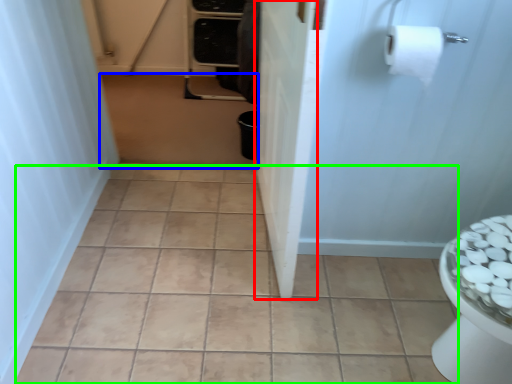
Question: Based on their relative distances, which object is nearer to screen door (highlighted by a red box)? Choose from plain (highlighted by a blue box) and ceramic tile (highlighted by a green box).

Choices:
 (A) plain
 (B) ceramic tile

Answer: (B)